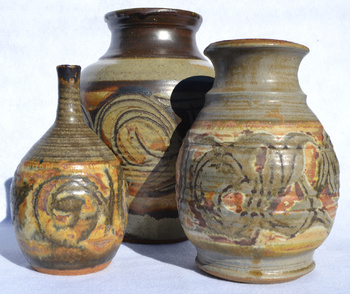
Image resolution: width=350 pixels, height=294 pixels. Find the location of `shadow on biggest clay pot from medium pot`. shadow on biggest clay pot from medium pot is located at coordinates (190, 112).